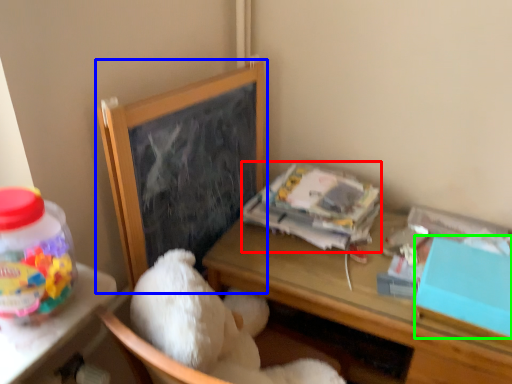
Question: Which object is the farthest from paperback book (highlighted by a red box)? Choose among these: bulletin board (highlighted by a blue box) or box (highlighted by a green box).

Choices:
 (A) bulletin board
 (B) box

Answer: (B)